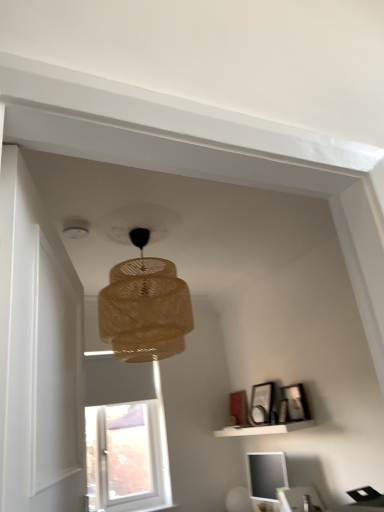
Question: Is point (238, 432) closer or farther from the camera than point (49, 262)?

Choices:
 (A) closer
 (B) farther

Answer: (B)

Question: Is white matte shelf at lower right bigger or smaller than white wooden door at left?

Choices:
 (A) big
 (B) small

Answer: (B)

Question: Which object is positioned farthest from the matte black picture frame at upper right, the 1th picture frame positioned from the left?

Choices:
 (A) braided wicker lampshade at center
 (B) white matte shelf at lower right
 (C) matte black picture frame at upper right, positioned as the second picture frame in left-to-right order
 (D) white wooden door at left
 (E) matte black monitor at lower right

Answer: (D)

Question: Estimate the real-world distances between objects in this image. Which object is closer to the white matte shelf at lower right?

Choices:
 (A) matte black picture frame at upper right, placed as the 2th picture frame when sorted from right to left
 (B) matte black monitor at lower right
 (C) braided wicker lampshade at center
 (D) matte black picture frame at upper right, positioned as the second picture frame in left-to-right order
 (E) white wooden door at left

Answer: (A)